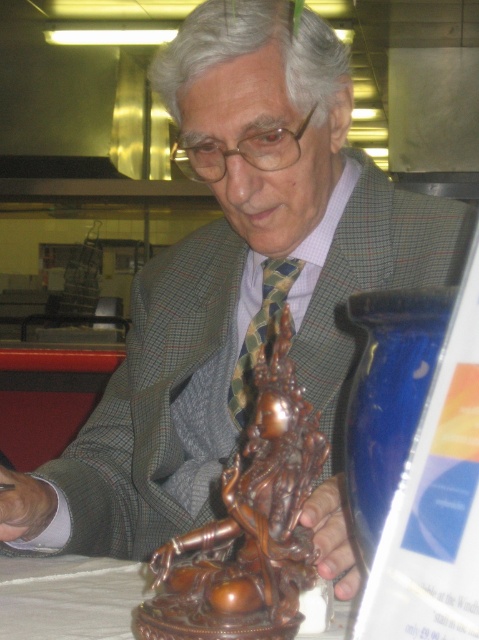
You are a GUI agent. You are given a task and a screenshot of the screen. Output one action in this format:
    pyautogui.click(x=<x>, y=<y>)
    Task: Click on the bronze statue at center
    The image size is (479, 640).
    Given the screenshot: What is the action you would take?
    pyautogui.click(x=248, y=524)

Does bronze statue at center appear on the left side of green checkered tie at center?

Indeed, bronze statue at center is positioned on the left side of green checkered tie at center.

The image size is (479, 640). In order to click on bronze statue at center in this screenshot , I will do [x=248, y=524].

Looking at this image, who is higher up, bronze statue at center or wooden statue at center?

bronze statue at center is higher up.

Is bronze statue at center to the left of wooden statue at center from the viewer's perspective?

Incorrect, bronze statue at center is not on the left side of wooden statue at center.

This screenshot has height=640, width=479. What are the coordinates of `bronze statue at center` in the screenshot? It's located at (248, 524).

How far apart are wooden statue at center and green checkered tie at center?

wooden statue at center is 12.85 inches away from green checkered tie at center.

Who is more distant from viewer, (101, 566) or (235, 372)?

Positioned behind is point (235, 372).

Is point (11, 577) positioned before point (239, 378)?

Yes, point (11, 577) is closer to viewer.

Where is `wooden statue at center`? Image resolution: width=479 pixels, height=640 pixels. wooden statue at center is located at coordinates coord(68,596).